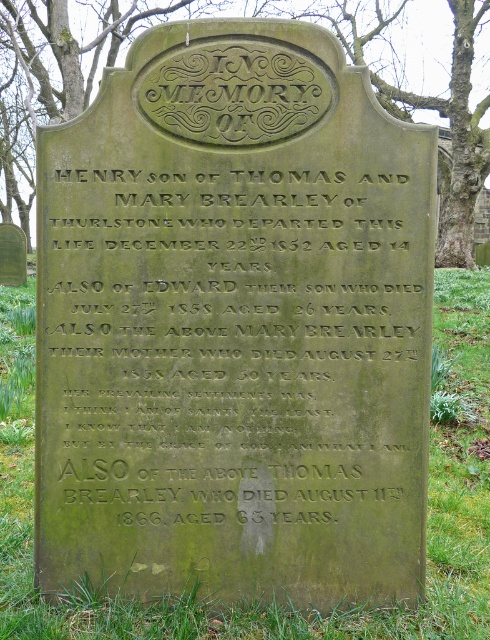
Question: Which of the following is the farthest from the observer?

Choices:
 (A) green stone inscription at center
 (B) green mossy stone at lower center
 (C) green mossy stone at upper center

Answer: (C)

Question: Does green mossy stone at lower center have a smaller size compared to green mossy stone at upper center?

Choices:
 (A) yes
 (B) no

Answer: (A)

Question: Does green stone inscription at center have a larger size compared to green mossy stone at upper center?

Choices:
 (A) no
 (B) yes

Answer: (A)

Question: Estimate the real-world distances between objects in this image. Which object is closer to the green mossy stone at lower center?

Choices:
 (A) green stone inscription at center
 (B) green mossy stone at upper center

Answer: (A)

Question: Is green stone inscription at center wider than green mossy stone at lower center?

Choices:
 (A) yes
 (B) no

Answer: (B)

Question: Which point is closer to the camera?

Choices:
 (A) green mossy stone at lower center
 (B) green mossy stone at upper center
 (C) green stone inscription at center

Answer: (A)